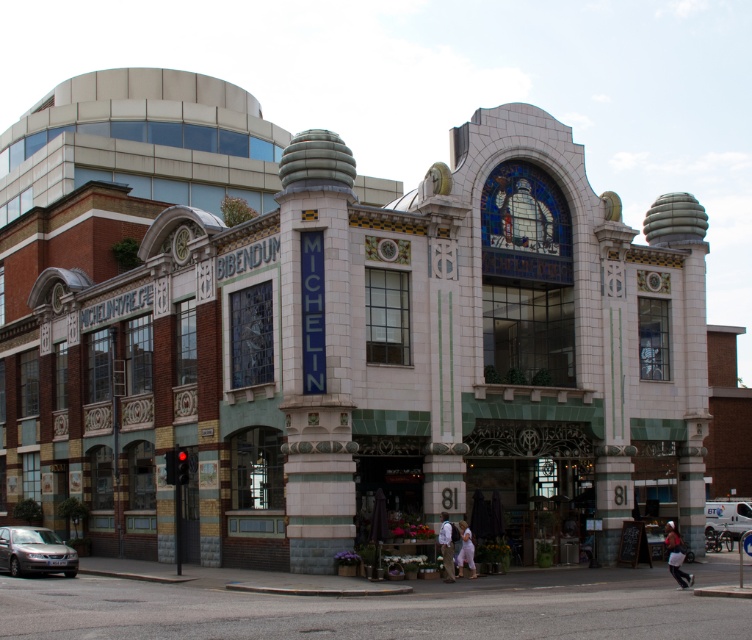
Does white tile department store at center have a lesser width compared to silver metallic car at lower left?

No.

In the scene shown: Does white tile department store at center appear on the left side of silver metallic car at lower left?

In fact, white tile department store at center is to the right of silver metallic car at lower left.

Between point (447, 300) and point (65, 561), which one is positioned in front?

Positioned in front is point (65, 561).

The height and width of the screenshot is (640, 752). Identify the location of white tile department store at center. (344, 340).